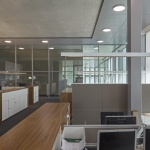
You are a GUI agent. You are given a task and a screenshot of the screen. Output one action in this format:
    pyautogui.click(x=<x>, y=<y>)
    Task: Click on the black back of computer screen
    The width and height of the screenshot is (150, 150).
    Given the screenshot: What is the action you would take?
    pyautogui.click(x=118, y=118)